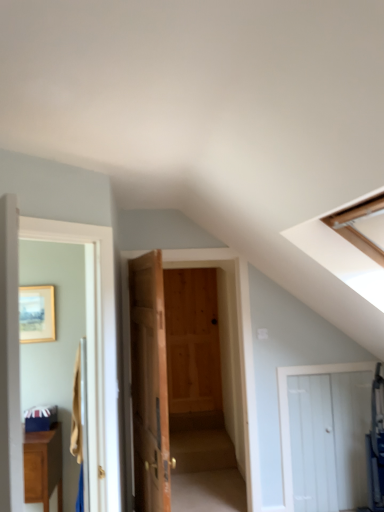
What do you see at coordinates (43, 466) in the screenshot? I see `matte brown cabinet at lower left` at bounding box center [43, 466].

Describe the element at coordinates (226, 337) in the screenshot. I see `natural wood door at center, which is the 2th door in right-to-left order` at that location.

Image resolution: width=384 pixels, height=512 pixels. In order to click on wooden door at center, acting as the second door starting from the left in this screenshot , I will do `click(149, 384)`.

What do you see at coordinates (37, 314) in the screenshot? I see `wooden picture frame at upper left` at bounding box center [37, 314].

At what (x,y) coordinates should I click in order to perform the action: click on matte brown cabinet at lower left. Please return your answer as a coordinate pair (x, y). The width and height of the screenshot is (384, 512). Looking at the image, I should click on (43, 466).

Is matte brown cabinet at lower left at the back of wooden door at center, which is the 3th door from right to left?

Yes, wooden door at center, which is the 3th door from right to left, is facing away from matte brown cabinet at lower left.

Based on the photo, how different are the orientations of wooden door at center, acting as the second door starting from the left, and matte brown cabinet at lower left in degrees?

They differ by 104 degrees in their facing directions.

Considering the relative sizes of wooden door at center, which is the 3th door from right to left, and matte brown cabinet at lower left in the image provided, is wooden door at center, which is the 3th door from right to left, wider than matte brown cabinet at lower left?

Incorrect, the width of wooden door at center, which is the 3th door from right to left, does not surpass that of matte brown cabinet at lower left.

In the image, is wooden door at center, acting as the second door starting from the left, positioned in front of or behind matte brown cabinet at lower left?

wooden door at center, acting as the second door starting from the left, is in front of matte brown cabinet at lower left.

Is matte brown cabinet at lower left at the right side of wooden picture frame at upper left?

Yes, matte brown cabinet at lower left is to the right of wooden picture frame at upper left.

How much distance is there between matte brown cabinet at lower left and wooden picture frame at upper left?

matte brown cabinet at lower left is 32.04 inches from wooden picture frame at upper left.

From the picture: Does matte brown cabinet at lower left have a larger size compared to wooden picture frame at upper left?

Correct, matte brown cabinet at lower left is larger in size than wooden picture frame at upper left.

Would you say matte brown cabinet at lower left is outside wooden picture frame at upper left?

Yes, matte brown cabinet at lower left is located beyond the bounds of wooden picture frame at upper left.

Is matte brown cabinet at lower left located outside wooden door at center, acting as the second door starting from the left?

Yes, matte brown cabinet at lower left is not within wooden door at center, acting as the second door starting from the left.

From a real-world perspective, who is located higher, matte brown cabinet at lower left or wooden door at center, which is the 3th door from right to left?

wooden door at center, which is the 3th door from right to left, from a real-world perspective.

Considering the relative sizes of matte brown cabinet at lower left and wooden door at center, which is the 3th door from right to left, in the image provided, is matte brown cabinet at lower left wider than wooden door at center, which is the 3th door from right to left,?

Yes.

In the scene shown: From the image's perspective, would you say matte brown cabinet at lower left is positioned over wooden door at center, which is the 3th door from right to left?

Actually, matte brown cabinet at lower left appears below wooden door at center, which is the 3th door from right to left, in the image.

Can you tell me how much white wooden door at lower right, the 4th door in the left-to-right sequence, and natural wood door at center, arranged as the 3th door when viewed from the left, differ in facing direction?

The angle between the facing direction of white wooden door at lower right, the 4th door in the left-to-right sequence, and the facing direction of natural wood door at center, arranged as the 3th door when viewed from the left, is 0.804 degrees.

In terms of width, does white wooden door at lower right, acting as the 1th door starting from the right, look wider or thinner when compared to natural wood door at center, arranged as the 3th door when viewed from the left?

white wooden door at lower right, acting as the 1th door starting from the right, is thinner than natural wood door at center, arranged as the 3th door when viewed from the left.

Looking at the image, does white wooden door at lower right, the 4th door in the left-to-right sequence, seem bigger or smaller compared to natural wood door at center, which is the 2th door in right-to-left order?

Considering their sizes, white wooden door at lower right, the 4th door in the left-to-right sequence, takes up less space than natural wood door at center, which is the 2th door in right-to-left order.

Do you think white wooden door at lower right, the 4th door in the left-to-right sequence, is within white wooden door at left, which appears as the 1th door when viewed from the left, or outside of it?

white wooden door at lower right, the 4th door in the left-to-right sequence, is not inside white wooden door at left, which appears as the 1th door when viewed from the left, it's outside.

Considering the relative sizes of white wooden door at lower right, acting as the 1th door starting from the right, and white wooden door at left, which appears as the 1th door when viewed from the left, in the image provided, is white wooden door at lower right, acting as the 1th door starting from the right, taller than white wooden door at left, which appears as the 1th door when viewed from the left,?

No, white wooden door at lower right, acting as the 1th door starting from the right, is not taller than white wooden door at left, which appears as the 1th door when viewed from the left.

Considering the positions of point (282, 456) and point (113, 441), is point (282, 456) closer or farther from the camera than point (113, 441)?

Point (282, 456).

From the image's perspective, starting from the white wooden door at lower right, the 4th door in the left-to-right sequence, which door is the 3rd one above? Please provide its 2D coordinates.

[(94, 348)]

Is wooden picture frame at upper left located outside matte brown cabinet at lower left?

Indeed, wooden picture frame at upper left is completely outside matte brown cabinet at lower left.

Which object is further away from the camera taking this photo, wooden picture frame at upper left or matte brown cabinet at lower left?

wooden picture frame at upper left is behind.

Considering the relative sizes of wooden picture frame at upper left and matte brown cabinet at lower left in the image provided, is wooden picture frame at upper left wider than matte brown cabinet at lower left?

In fact, wooden picture frame at upper left might be narrower than matte brown cabinet at lower left.

From the image's perspective, is wooden picture frame at upper left positioned above or below matte brown cabinet at lower left?

wooden picture frame at upper left is above matte brown cabinet at lower left.

Which of these two, wooden picture frame at upper left or white wooden door at lower right, acting as the 1th door starting from the right, is smaller?

With smaller size is wooden picture frame at upper left.

Does wooden picture frame at upper left touch white wooden door at lower right, the 4th door in the left-to-right sequence?

There is a gap between wooden picture frame at upper left and white wooden door at lower right, the 4th door in the left-to-right sequence.

Does wooden picture frame at upper left have a lesser height compared to white wooden door at lower right, the 4th door in the left-to-right sequence?

Indeed, wooden picture frame at upper left has a lesser height compared to white wooden door at lower right, the 4th door in the left-to-right sequence.

From a real-world perspective, is wooden picture frame at upper left positioned above or below white wooden door at lower right, acting as the 1th door starting from the right?

Clearly, from a real-world perspective, wooden picture frame at upper left is above white wooden door at lower right, acting as the 1th door starting from the right.

At what (x,y) coordinates should I click in order to perform the action: click on cabinetry located on the left of wooden door at center, which is the 3th door from right to left. Please return your answer as a coordinate pair (x, y). Looking at the image, I should click on (43, 466).

At what (x,y) coordinates should I click in order to perform the action: click on cabinetry that appears below the wooden picture frame at upper left (from a real-world perspective). Please return your answer as a coordinate pair (x, y). The image size is (384, 512). Looking at the image, I should click on (43, 466).

When comparing their distances from wooden picture frame at upper left, does white wooden door at lower right, the 4th door in the left-to-right sequence, or matte brown cabinet at lower left seem closer?

matte brown cabinet at lower left lies closer to wooden picture frame at upper left than the other object.

Which object lies further to the anchor point matte brown cabinet at lower left, wooden picture frame at upper left or natural wood door at center, which is the 2th door in right-to-left order?

natural wood door at center, which is the 2th door in right-to-left order, lies further to matte brown cabinet at lower left than the other object.

Looking at this image, from the image, which object appears to be farther from wooden picture frame at upper left, white wooden door at left, the 4th door positioned from the right, or white wooden door at lower right, acting as the 1th door starting from the right?

white wooden door at lower right, acting as the 1th door starting from the right, is further to wooden picture frame at upper left.

When comparing their distances from matte brown cabinet at lower left, does white wooden door at left, the 4th door positioned from the right, or wooden picture frame at upper left seem closer?

Among the two, wooden picture frame at upper left is located nearer to matte brown cabinet at lower left.

Considering their positions, is matte brown cabinet at lower left positioned further to wooden door at center, acting as the second door starting from the left, than white wooden door at lower right, acting as the 1th door starting from the right?

Based on the image, white wooden door at lower right, acting as the 1th door starting from the right, appears to be further to wooden door at center, acting as the second door starting from the left.

Considering their positions, is white wooden door at left, which appears as the 1th door when viewed from the left, positioned closer to wooden door at center, acting as the second door starting from the left, than white wooden door at lower right, the 4th door in the left-to-right sequence?

Based on the image, white wooden door at left, which appears as the 1th door when viewed from the left, appears to be nearer to wooden door at center, acting as the second door starting from the left.

Looking at the image, which one is located closer to wooden door at center, acting as the second door starting from the left, white wooden door at left, which appears as the 1th door when viewed from the left, or natural wood door at center, which is the 2th door in right-to-left order?

white wooden door at left, which appears as the 1th door when viewed from the left, lies closer to wooden door at center, acting as the second door starting from the left, than the other object.

When comparing their distances from wooden picture frame at upper left, does white wooden door at left, the 4th door positioned from the right, or natural wood door at center, which is the 2th door in right-to-left order, seem closer?

white wooden door at left, the 4th door positioned from the right, lies closer to wooden picture frame at upper left than the other object.

The height and width of the screenshot is (512, 384). I want to click on cabinetry between white wooden door at left, the 4th door positioned from the right, and natural wood door at center, which is the 2th door in right-to-left order, in the front-back direction, so click(x=43, y=466).

Where is `cabinetry between white wooden door at left, which appears as the 1th door when viewed from the left, and wooden picture frame at upper left from front to back`? cabinetry between white wooden door at left, which appears as the 1th door when viewed from the left, and wooden picture frame at upper left from front to back is located at coordinates (43, 466).

Find the location of a particular element. The width and height of the screenshot is (384, 512). cabinetry between wooden picture frame at upper left and natural wood door at center, arranged as the 3th door when viewed from the left, in the horizontal direction is located at coordinates (43, 466).

The height and width of the screenshot is (512, 384). I want to click on cabinetry located between wooden picture frame at upper left and white wooden door at lower right, the 4th door in the left-to-right sequence, in the left-right direction, so click(x=43, y=466).